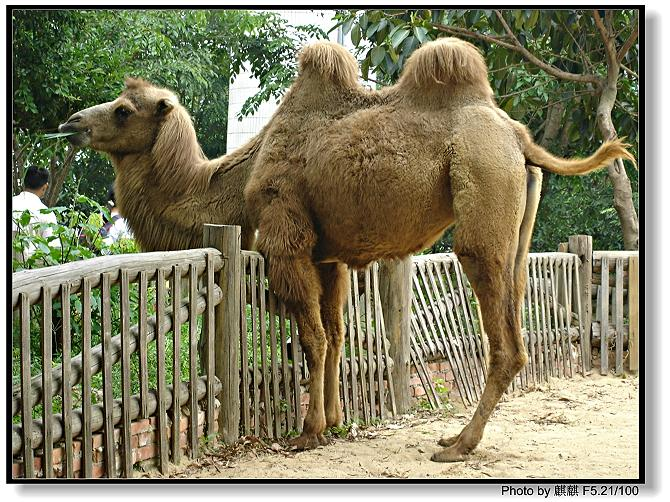
In order to click on left front leg in this screenshot , I will do `click(293, 301)`.